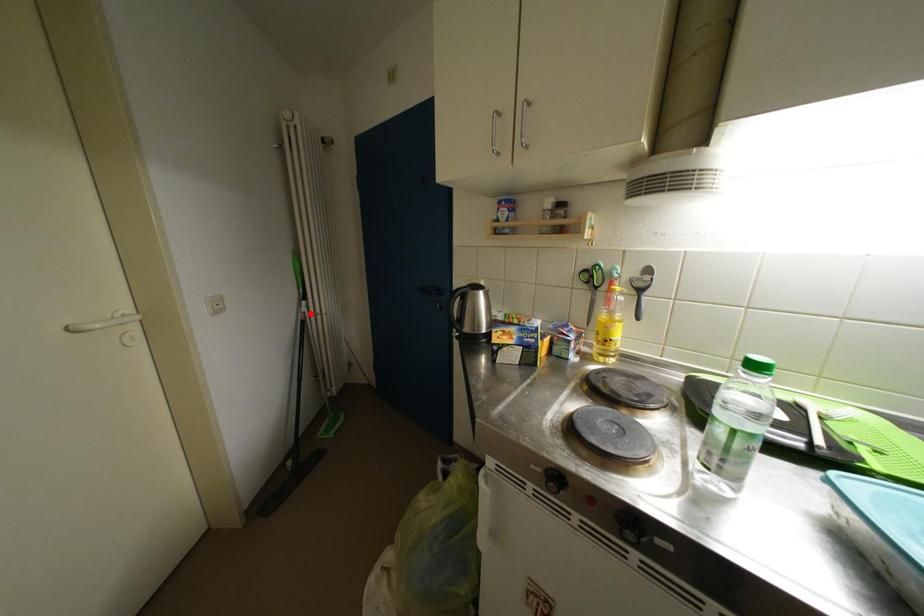
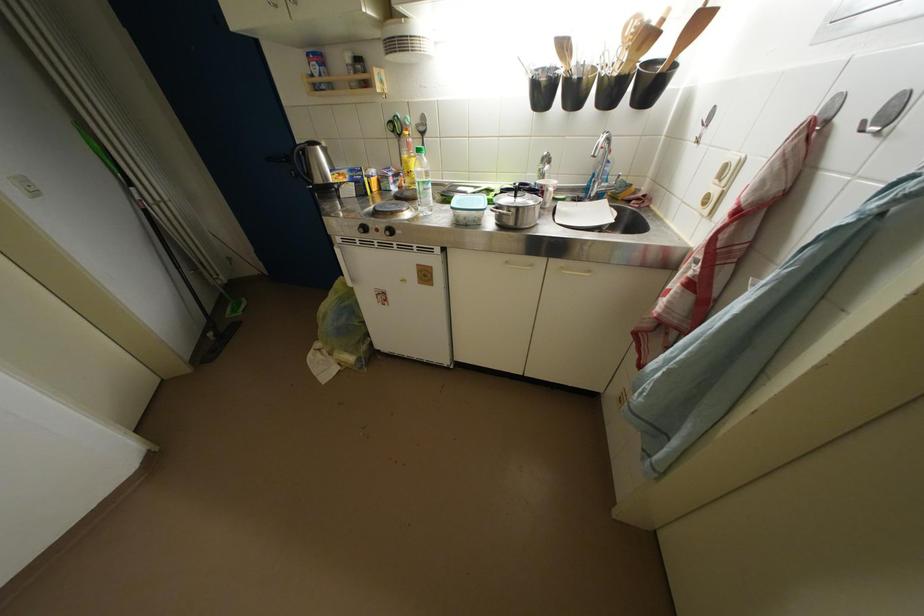
In the second image, find the point that corresponds to the highlighted location in the first image.

(144, 201)